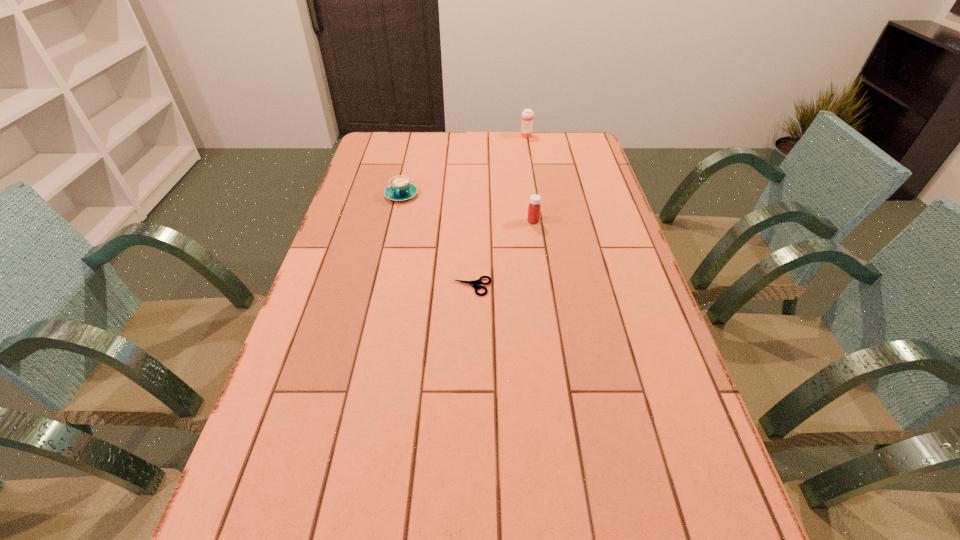
Where is `free space that satisfies the following two spatial constraints: 1. with the handle on the right side of the shears; 2. on the right side of the leftmost object`? This screenshot has width=960, height=540. free space that satisfies the following two spatial constraints: 1. with the handle on the right side of the shears; 2. on the right side of the leftmost object is located at coordinates (380, 287).

I want to click on vacant point that satisfies the following two spatial constraints: 1. on the back side of the third farthest object; 2. on the left side of the taller medicine, so click(x=521, y=136).

The height and width of the screenshot is (540, 960). I want to click on vacant region that satisfies the following two spatial constraints: 1. with the handle on the right side of the third tallest object; 2. on the left side of the nearest object, so (380, 287).

This screenshot has width=960, height=540. I want to click on blank space that satisfies the following two spatial constraints: 1. with the handle on the right side of the nearest object; 2. on the right side of the cappuccino, so click(380, 287).

This screenshot has height=540, width=960. What are the coordinates of `free space that satisfies the following two spatial constraints: 1. on the back side of the second nearest object; 2. on the left side of the shortest object` in the screenshot? It's located at (472, 221).